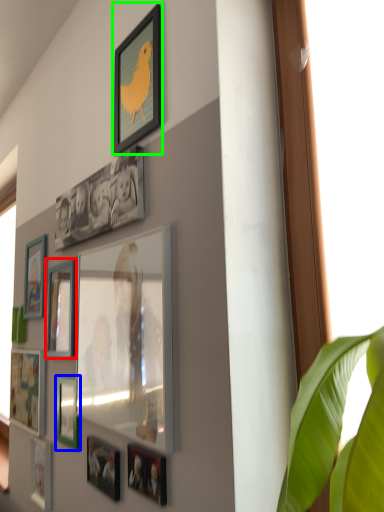
Question: Estimate the real-world distances between objects in this image. Which object is closer to picture frame (highlighted by a red box), picture frame (highlighted by a blue box) or picture frame (highlighted by a green box)?

Choices:
 (A) picture frame
 (B) picture frame

Answer: (A)